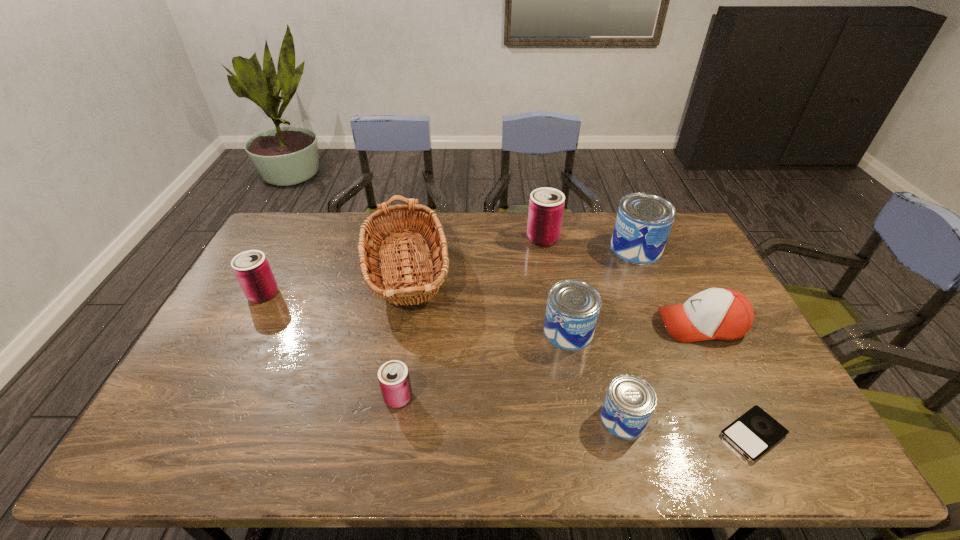
Where is `basket`? basket is located at coordinates pyautogui.click(x=395, y=289).

Find the location of a particular element. the farthest pink can is located at coordinates (546, 205).

Where is `the rightmost pink can`? the rightmost pink can is located at coordinates (546, 205).

Where is `the farthest blue can`? the farthest blue can is located at coordinates (644, 221).

Identify the location of the biggest blue can. point(644,221).

At what (x,y) coordinates should I click in order to perform the action: click on the leftmost object. Please return your answer as a coordinate pair (x, y). The image size is (960, 540). Looking at the image, I should click on (251, 268).

Locate an element on the screen. Image resolution: width=960 pixels, height=540 pixels. the leftmost can is located at coordinates (251, 268).

Identify the location of the second nearest blue can. The height and width of the screenshot is (540, 960). (573, 306).

Locate an element on the screen. This screenshot has height=540, width=960. the fourth farthest can is located at coordinates (573, 306).

The height and width of the screenshot is (540, 960). I want to click on baseball cap, so click(x=723, y=314).